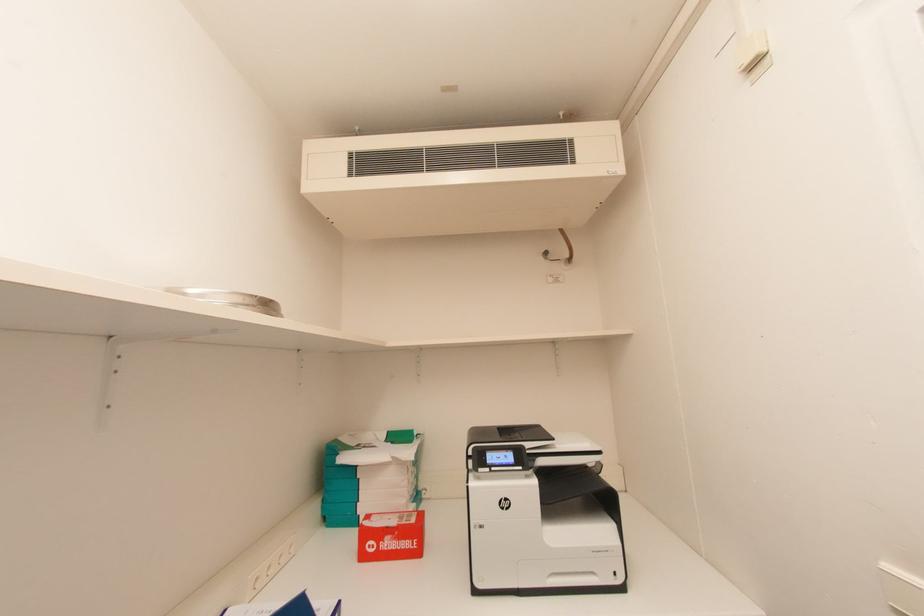
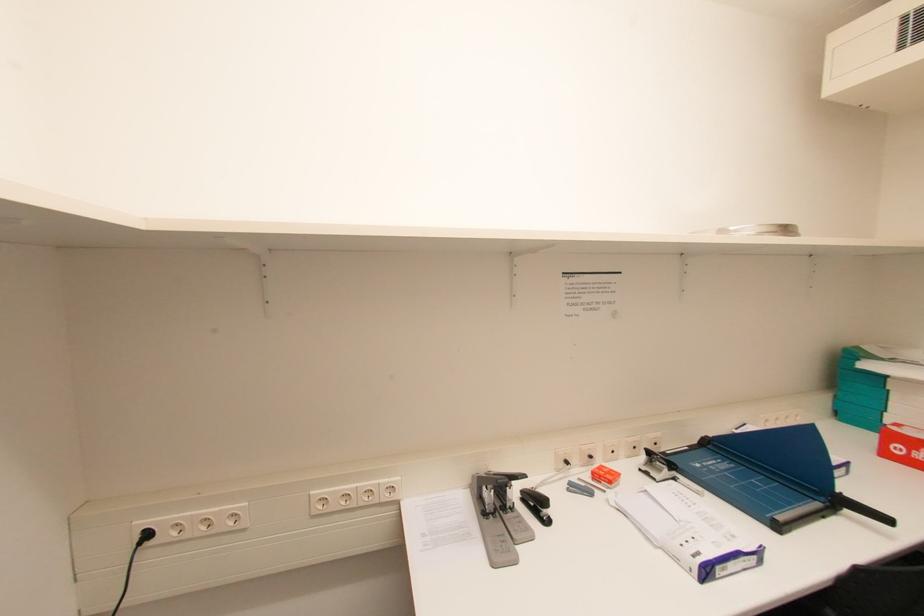
Question: The camera is either moving clockwise (left) or counter-clockwise (right) around the object. The first image is from the beginning of the video and the second image is from the end. Is the camera moving left or right when shooting the video?

Choices:
 (A) Left
 (B) Right

Answer: (B)